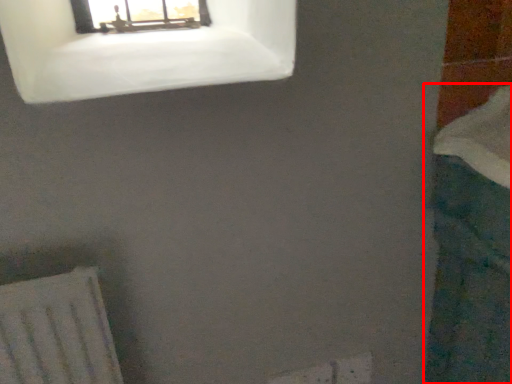
Question: From the image's perspective, where is bath (annotated by the red box) located in relation to window in the image?

Choices:
 (A) above
 (B) below

Answer: (B)